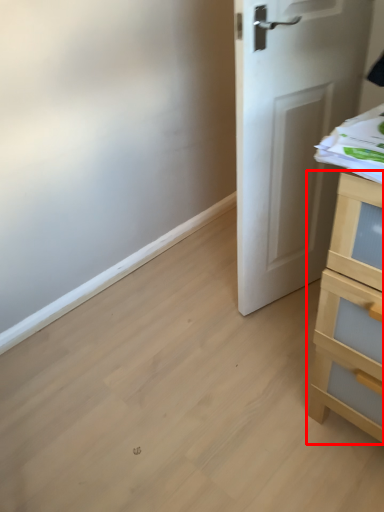
Question: From the image's perspective, where is chest of drawers (annotated by the red box) located relative to door?

Choices:
 (A) below
 (B) above

Answer: (A)